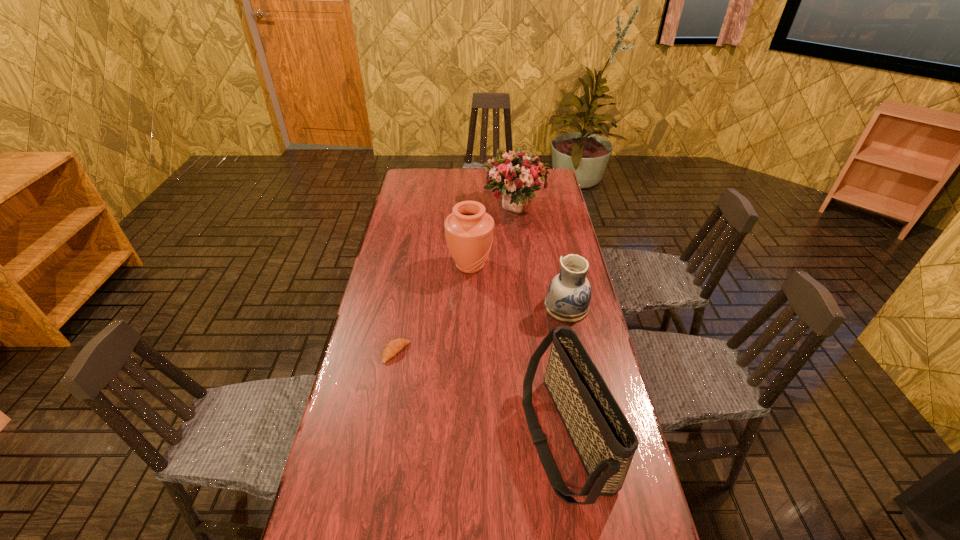
I want to click on bouquet, so click(517, 175).

You are a GUI agent. You are given a task and a screenshot of the screen. Output one action in this format:
    pyautogui.click(x=<x>, y=<y>)
    Task: Click on the vase
    This screenshot has width=960, height=540.
    Given the screenshot: What is the action you would take?
    pyautogui.click(x=469, y=229)

Locate an element on the screen. The width and height of the screenshot is (960, 540). the nearest object is located at coordinates (604, 440).

This screenshot has width=960, height=540. I want to click on pottery, so click(569, 293).

Locate an element on the screen. crescent roll is located at coordinates (393, 347).

Locate an element on the screen. the shortest object is located at coordinates (393, 347).

Where is `blank area located 0.130m on the left of the bouquet`? This screenshot has height=540, width=960. blank area located 0.130m on the left of the bouquet is located at coordinates (451, 206).

Locate an element on the screen. The height and width of the screenshot is (540, 960). free space located 0.330m on the back of the fourth nearest object is located at coordinates (471, 206).

Locate an element on the screen. vacant area situated on the left of the nearest object is located at coordinates (489, 438).

Find the location of a particular element. The image size is (960, 540). vacant position located 0.110m on the left of the pottery is located at coordinates (511, 307).